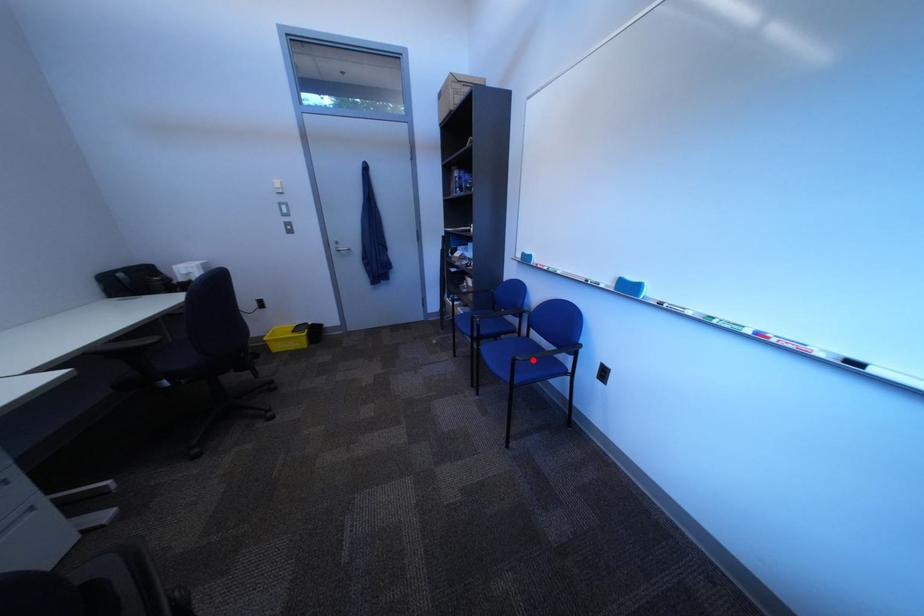
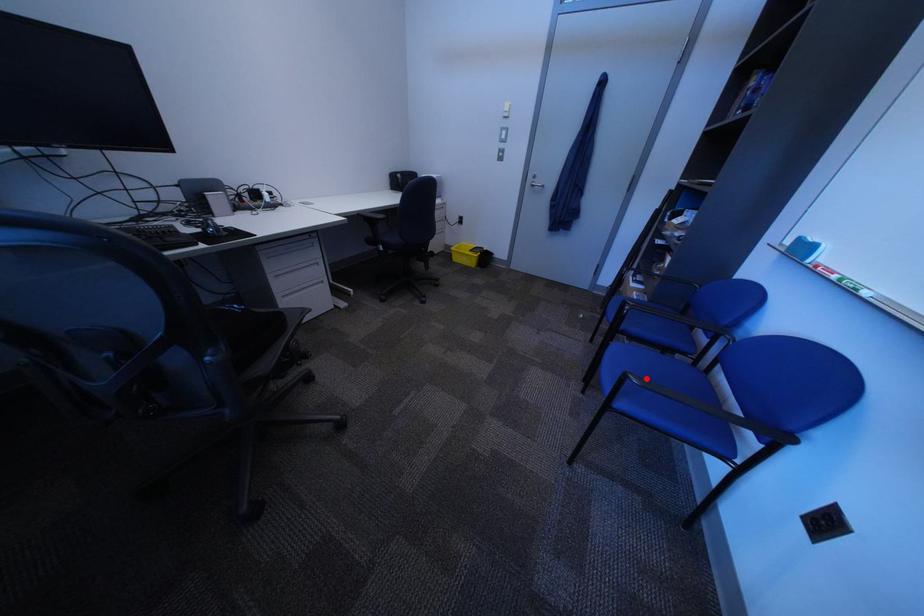
I am providing you with two images of the same scene from different viewpoints. A red point is marked on the first image and another point is marked on the second image. Does the point marked in image1 correspond to the same location as the one in image2?

Yes